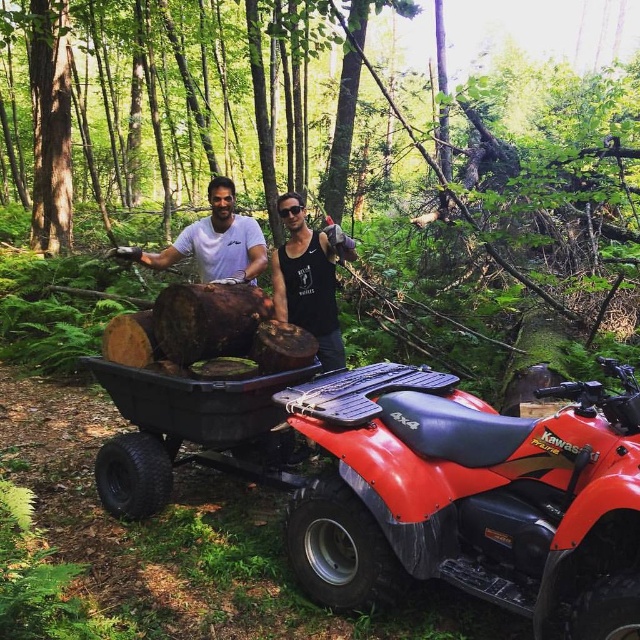
Question: Where is black plastic wagon at center located in relation to white matte shirt at center in the image?

Choices:
 (A) above
 (B) below

Answer: (B)

Question: Which point is closer to the camera?

Choices:
 (A) (323, 273)
 (B) (129, 397)
 (C) (186, 244)

Answer: (B)

Question: Where is smooth wood logs at center located in relation to black matte tank top at center in the image?

Choices:
 (A) right
 (B) left

Answer: (B)

Question: Which object is farther from the camera taking this photo?

Choices:
 (A) black plastic wagon at center
 (B) smooth wood logs at center

Answer: (B)

Question: Can you confirm if black plastic wagon at center is bigger than black matte tank top at center?

Choices:
 (A) yes
 (B) no

Answer: (B)

Question: Which of these objects is positioned closest to the black plastic wagon at center?

Choices:
 (A) matte black t-shirt at center
 (B) smooth wood logs at center
 (C) black matte tank top at center

Answer: (C)